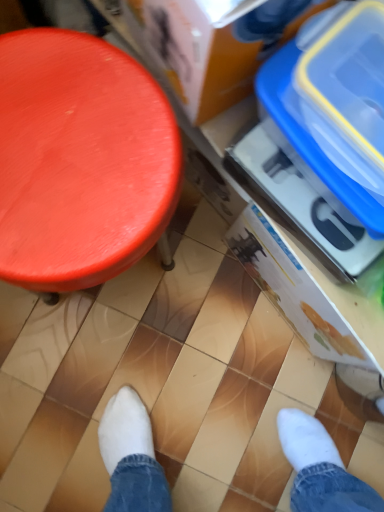
Question: Considering the relative positions of blue plastic storage box at upper right, the 2th storage box positioned from the front, and smooth orange stool at left in the image provided, is blue plastic storage box at upper right, the 2th storage box positioned from the front, to the left of smooth orange stool at left from the viewer's perspective?

Choices:
 (A) no
 (B) yes

Answer: (A)

Question: Does blue plastic storage box at upper right, the 2th storage box positioned from the front, have a lesser width compared to smooth orange stool at left?

Choices:
 (A) no
 (B) yes

Answer: (B)

Question: Does blue plastic storage box at upper right, the 2th storage box positioned from the front, have a lesser height compared to smooth orange stool at left?

Choices:
 (A) no
 (B) yes

Answer: (B)

Question: From the image's perspective, is blue plastic storage box at upper right, the 2th storage box viewed from the back, located beneath smooth orange stool at left?

Choices:
 (A) yes
 (B) no

Answer: (B)

Question: From a real-world perspective, is blue plastic storage box at upper right, the 2th storage box viewed from the back, on top of smooth orange stool at left?

Choices:
 (A) yes
 (B) no

Answer: (A)

Question: From their relative heights in the image, would you say blue plastic storage box at right, which is the 1th storage box from back to front, is taller or shorter than smooth orange stool at left?

Choices:
 (A) short
 (B) tall

Answer: (A)

Question: Is blue plastic storage box at right, the third storage box viewed from the front, bigger or smaller than smooth orange stool at left?

Choices:
 (A) big
 (B) small

Answer: (B)

Question: Is blue plastic storage box at right, the third storage box viewed from the front, situated inside smooth orange stool at left or outside?

Choices:
 (A) inside
 (B) outside

Answer: (B)

Question: Considering their positions, is blue plastic storage box at right, the third storage box viewed from the front, located in front of or behind smooth orange stool at left?

Choices:
 (A) front
 (B) behind

Answer: (B)

Question: Does point (286, 46) appear closer or farther from the camera than point (57, 229)?

Choices:
 (A) closer
 (B) farther

Answer: (A)

Question: From a real-world perspective, relative to smooth orange stool at left, is blue plastic storage box at upper right, the 2th storage box positioned from the front, vertically above or below?

Choices:
 (A) above
 (B) below

Answer: (A)

Question: Considering the positions of blue plastic storage box at upper right, the 2th storage box positioned from the front, and smooth orange stool at left in the image, is blue plastic storage box at upper right, the 2th storage box positioned from the front, taller or shorter than smooth orange stool at left?

Choices:
 (A) tall
 (B) short

Answer: (B)

Question: From the image's perspective, relative to smooth orange stool at left, is blue plastic storage box at upper right, the 2th storage box positioned from the front, above or below?

Choices:
 (A) below
 (B) above

Answer: (B)

Question: Considering the positions of blue plastic storage box at upper right, the 2th storage box positioned from the front, and blue plastic storage box at right, which is the 1th storage box from back to front, in the image, is blue plastic storage box at upper right, the 2th storage box positioned from the front, bigger or smaller than blue plastic storage box at right, which is the 1th storage box from back to front,?

Choices:
 (A) small
 (B) big

Answer: (A)

Question: Considering the positions of blue plastic storage box at upper right, the 2th storage box viewed from the back, and blue plastic storage box at right, the third storage box viewed from the front, in the image, is blue plastic storage box at upper right, the 2th storage box viewed from the back, wider or thinner than blue plastic storage box at right, the third storage box viewed from the front,?

Choices:
 (A) thin
 (B) wide

Answer: (B)